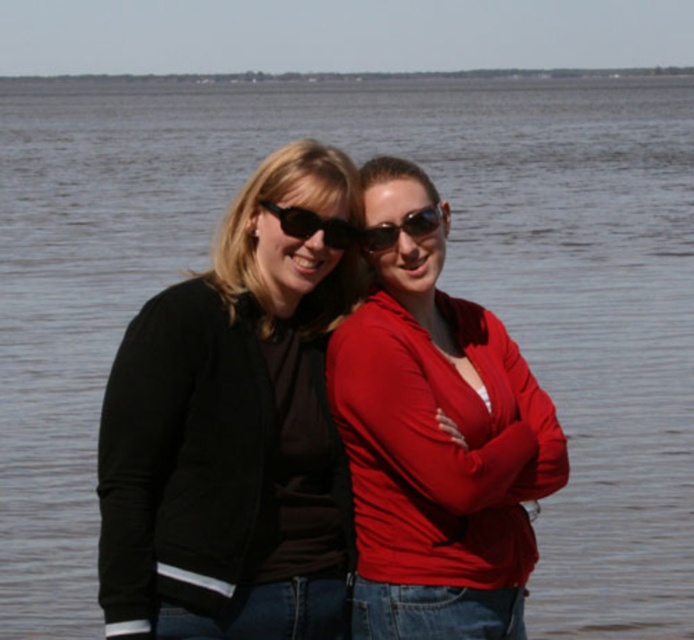
Question: Does matte red jacket at center have a greater width compared to black plastic sunglasses at center?

Choices:
 (A) yes
 (B) no

Answer: (A)

Question: Which object appears closest to the camera in this image?

Choices:
 (A) matte red jacket at center
 (B) black plastic sunglasses at center
 (C) black matte jacket at left

Answer: (C)

Question: Among these objects, which one is farthest from the camera?

Choices:
 (A) black matte jacket at left
 (B) black plastic sunglasses at center

Answer: (B)

Question: Is matte red jacket at center positioned behind black plastic sunglasses at center?

Choices:
 (A) no
 (B) yes

Answer: (A)

Question: Considering the real-world distances, which object is closest to the black plastic sunglasses at center?

Choices:
 (A) sunglasses at center
 (B) black matte jacket at left

Answer: (A)

Question: Does black matte jacket at left have a smaller size compared to black plastic sunglasses at center?

Choices:
 (A) no
 (B) yes

Answer: (A)